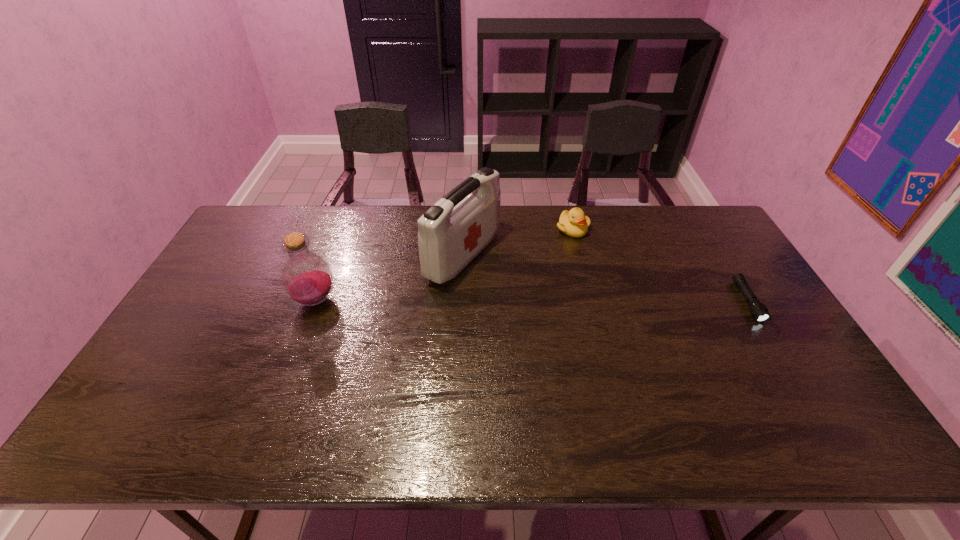
You are a GUI agent. You are given a task and a screenshot of the screen. Output one action in this format:
    pyautogui.click(x=<x>, y=<y>)
    Task: Click on the blank space located on the front side of the first-aid kit
    The height and width of the screenshot is (540, 960).
    Given the screenshot: What is the action you would take?
    pyautogui.click(x=535, y=291)

I want to click on free point located 0.390m on the beak of the second shortest object, so click(575, 323).

I want to click on vacant space located 0.160m on the beak of the second shortest object, so click(x=573, y=270).

Locate an element on the screen. vacant space positioned on the beak of the second shortest object is located at coordinates (574, 301).

Image resolution: width=960 pixels, height=540 pixels. Find the location of `the first-aid kit that is at the far edge`. the first-aid kit that is at the far edge is located at coordinates (451, 233).

The height and width of the screenshot is (540, 960). I want to click on duckling located at the far edge, so click(573, 223).

Identify the location of object that is at the right edge. The width and height of the screenshot is (960, 540). (759, 311).

Find the location of a particular element. The width and height of the screenshot is (960, 540). vacant space at the far edge is located at coordinates (376, 211).

I want to click on free space at the near edge, so click(x=338, y=394).

Locate an element on the screen. vacant space at the left edge is located at coordinates (228, 296).